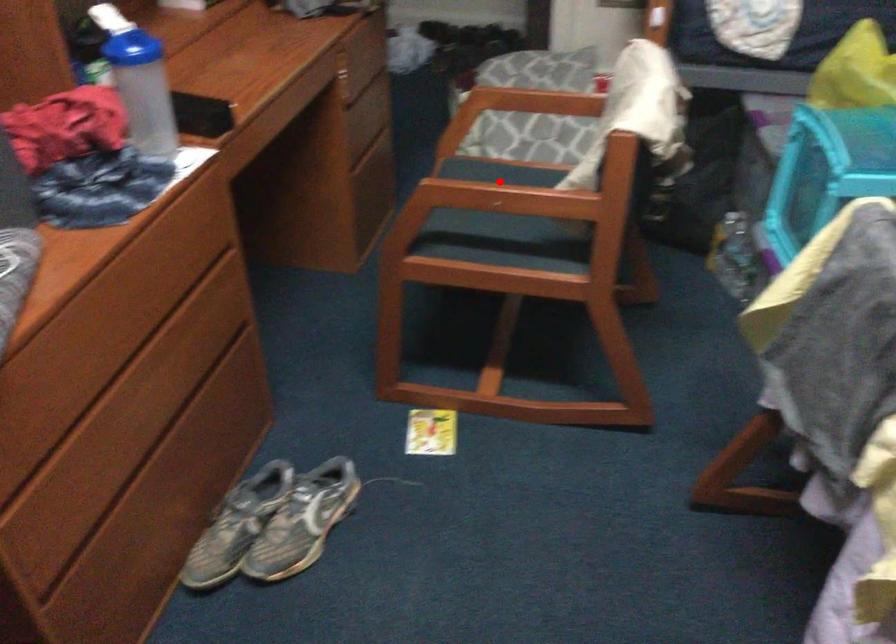
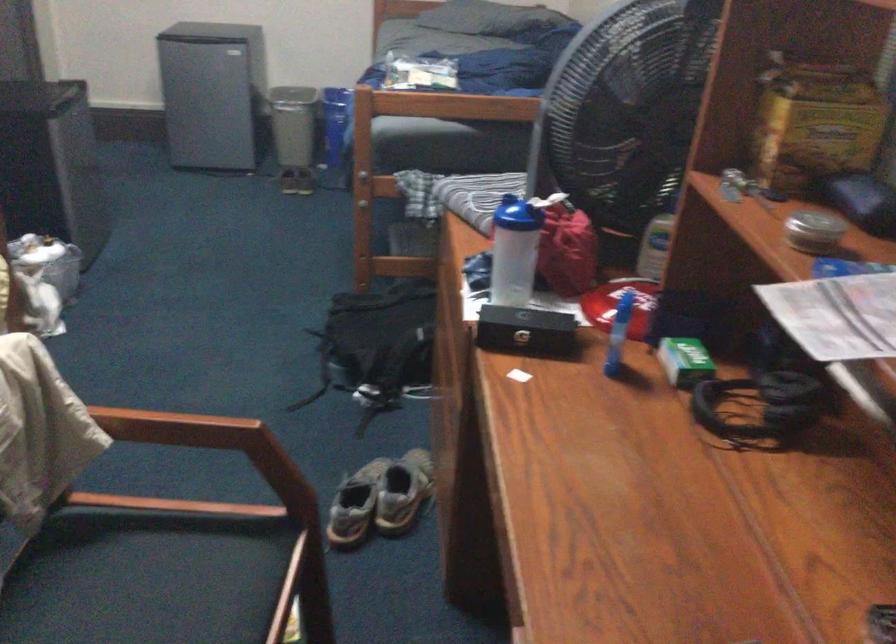
Locate, in the second image, the point that corresponds to the highlighted location in the first image.

(176, 428)